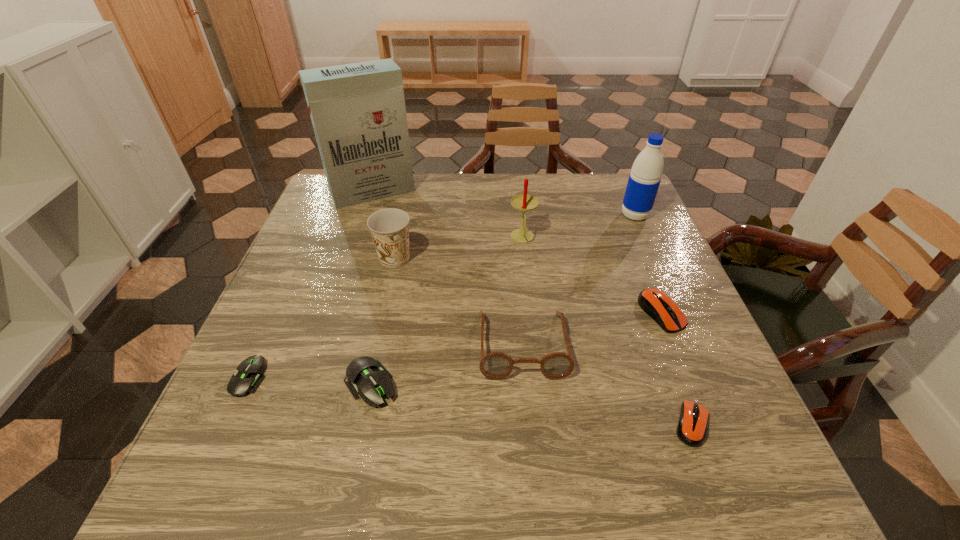
The height and width of the screenshot is (540, 960). In order to click on vacant area that lies between the spectacles and the smaller orange computer mouse in this screenshot , I will do `click(608, 384)`.

Where is `free spot between the smaller orange computer mouse and the farther orange computer mouse`? This screenshot has width=960, height=540. free spot between the smaller orange computer mouse and the farther orange computer mouse is located at coordinates (677, 369).

Identify the location of free space between the bigger orange computer mouse and the candle. (591, 276).

Where is `vacant region between the water bottle and the farther orange computer mouse`? The image size is (960, 540). vacant region between the water bottle and the farther orange computer mouse is located at coordinates (648, 264).

Identify the location of empty space between the smaller orange computer mouse and the spectacles. The width and height of the screenshot is (960, 540). (608, 384).

Image resolution: width=960 pixels, height=540 pixels. In order to click on vacant space in between the left gray computer mouse and the blue water bottle in this screenshot , I will do `click(442, 296)`.

The image size is (960, 540). I want to click on object that is the second closest one to the sixth shortest object, so click(x=496, y=365).

You are a GUI agent. You are given a task and a screenshot of the screen. Output one action in this format:
    pyautogui.click(x=<x>, y=<y>)
    Task: Click on the third closest object to the left gray computer mouse
    This screenshot has width=960, height=540.
    Given the screenshot: What is the action you would take?
    pyautogui.click(x=496, y=365)

Locate an element on the screen. This screenshot has width=960, height=540. computer mouse that is the second nearest to the bigger orange computer mouse is located at coordinates (364, 375).

Find the location of a particular element. The width and height of the screenshot is (960, 540). the closest computer mouse relative to the blue water bottle is located at coordinates (660, 307).